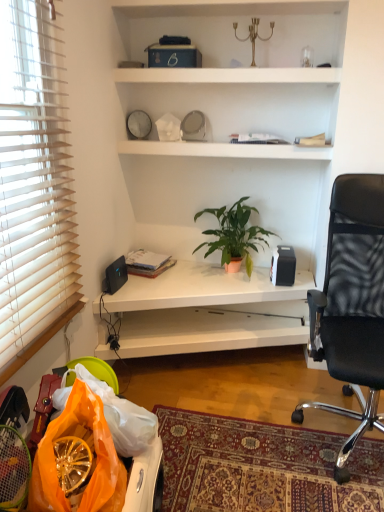
The image size is (384, 512). I want to click on vacant space underneath green matte plant at center (from a real-world perspective), so click(224, 274).